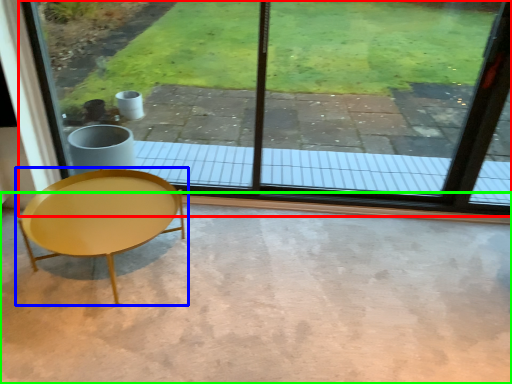
Question: Which object is positioned farthest from window (highlighted by a red box)? Select from coffee table (highlighted by a blue box) and concrete (highlighted by a green box).

Choices:
 (A) coffee table
 (B) concrete

Answer: (A)